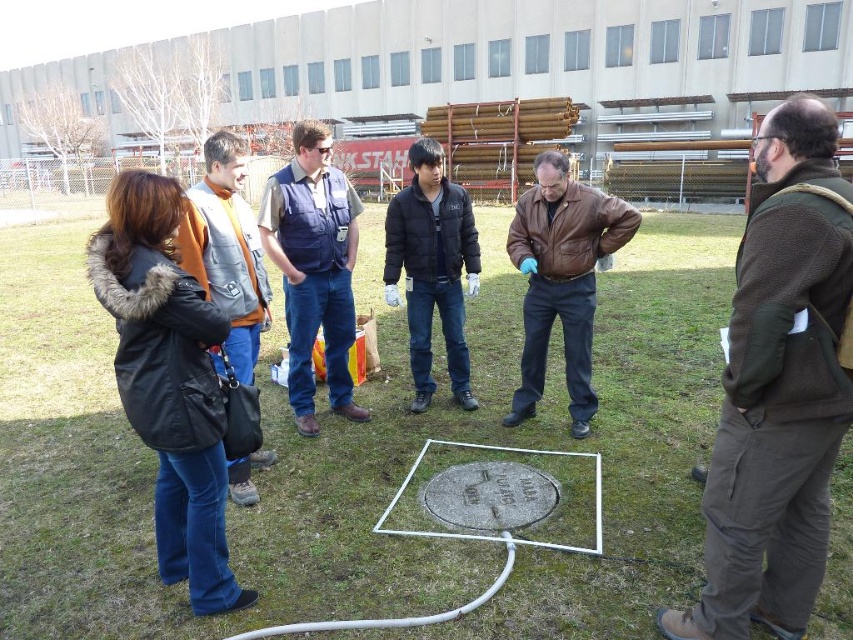
You are standing at the origin point of the coordinate system. You want to move towards the brown leather jacket at center. What are the coordinates you need to move to reach it?

The coordinates to reach the brown leather jacket at center are at point (561, 280).